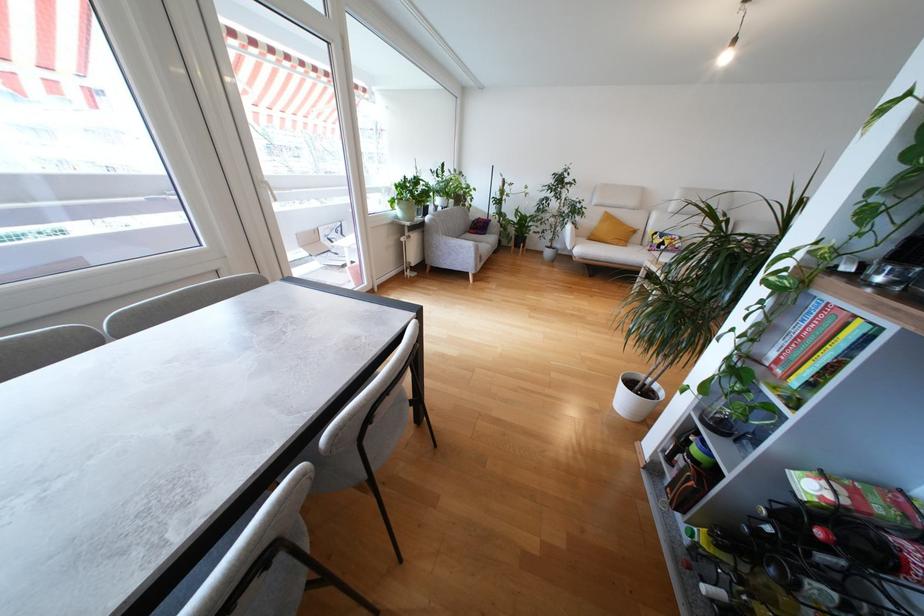
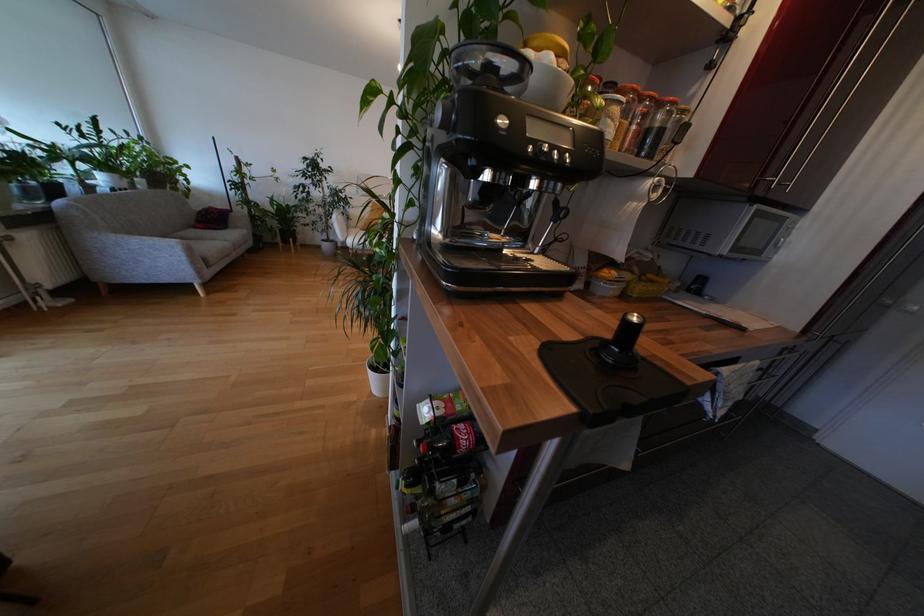
Locate, in the second image, the point that corresponds to (x=473, y=235) in the first image.

(200, 230)